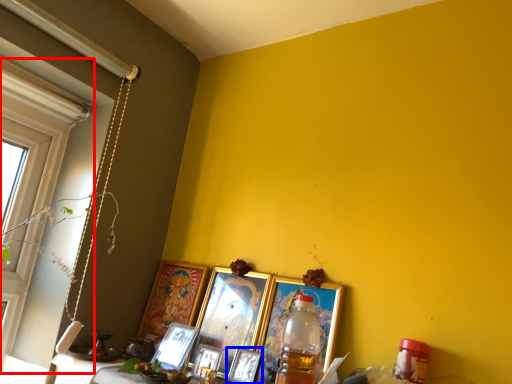
Question: Which point is further to the camera, window (highlighted by a red box) or picture frame (highlighted by a blue box)?

Choices:
 (A) window
 (B) picture frame

Answer: (B)